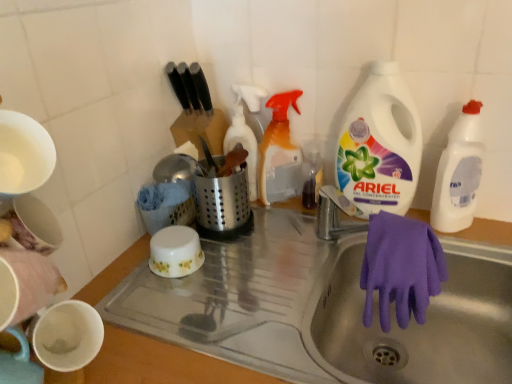
Question: Looking at their shapes, would you say white plastic bottle at upper right, which is the fourth cleaning product from left to right, is wider or thinner than purple rubber glove at lower right?

Choices:
 (A) thin
 (B) wide

Answer: (A)

Question: Is white plastic bottle at upper right, which is the fourth cleaning product from left to right, to the left or to the right of purple rubber glove at lower right in the image?

Choices:
 (A) right
 (B) left

Answer: (A)

Question: Which is nearer to the white plastic bottle at upper right, arranged as the 3th cleaning product when viewed from the left?

Choices:
 (A) purple rubber glove at sink
 (B) white plastic bottle at upper right, which is the fourth cleaning product from left to right
 (C) translucent plastic spray bottle at center, which is the second cleaning product from left to right
 (D) translucent plastic spray bottle at upper center, which ranks as the fourth cleaning product in right-to-left order
 (E) purple rubber glove at lower right

Answer: (B)

Question: Based on their relative distances, which object is nearer to the translucent plastic spray bottle at upper center, positioned as the first cleaning product in left-to-right order?

Choices:
 (A) white plastic bottle at upper right, which is counted as the 1th cleaning product, starting from the right
 (B) translucent plastic spray bottle at center, acting as the 3th cleaning product starting from the right
 (C) purple rubber glove at sink
 (D) white plastic bottle at upper right, the second cleaning product viewed from the right
 (E) purple rubber glove at lower right

Answer: (B)